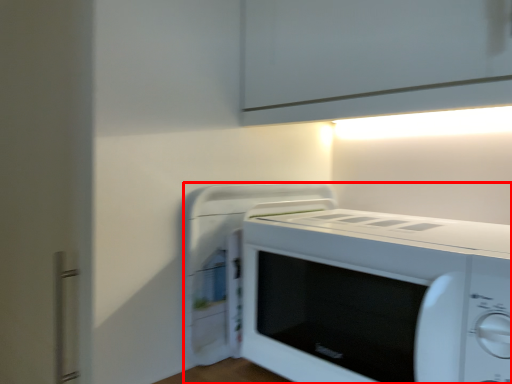
Question: From the image's perspective, what is the correct spatial positioning of home appliance (annotated by the red box) in reference to appliance?

Choices:
 (A) below
 (B) above

Answer: (A)